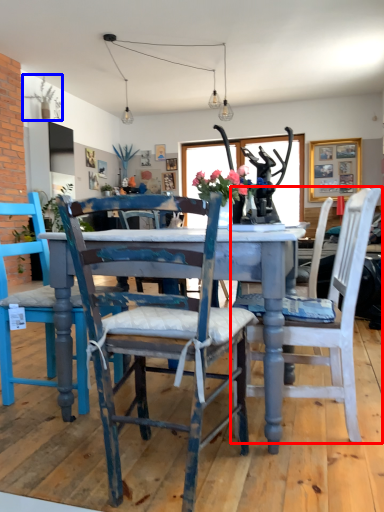
Question: Among these objects, which one is nearest to the camera, chair (highlighted by a red box) or plant (highlighted by a blue box)?

Choices:
 (A) chair
 (B) plant

Answer: (A)